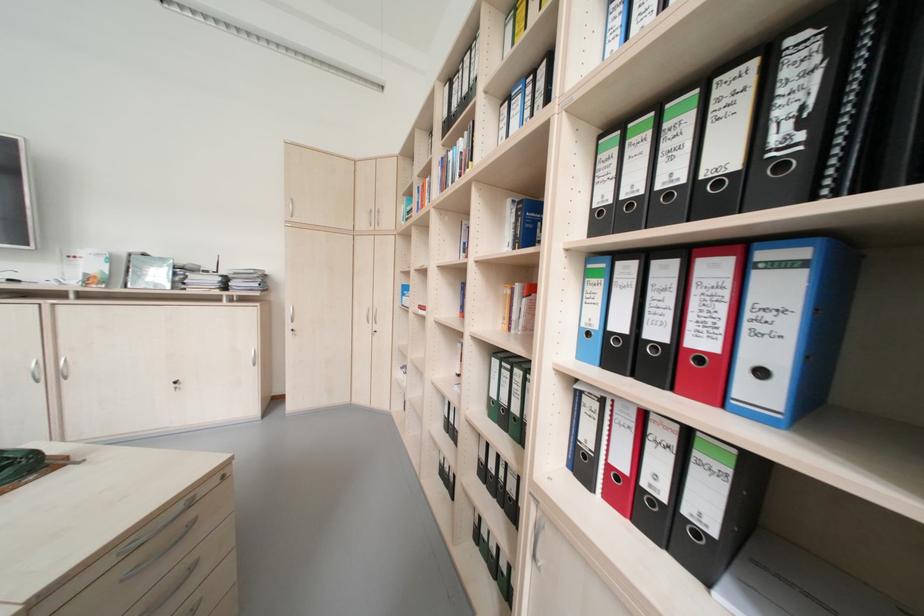
Where would you pull the binder finger hole? Please return your answer as a coordinate pair (x, y).

(760, 373)